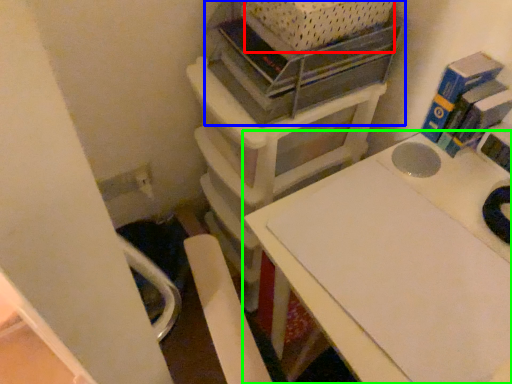
Question: Estimate the real-world distances between objects in this image. Which object is farther from crate (highlighted by a red box), shelf (highlighted by a blue box) or table (highlighted by a green box)?

Choices:
 (A) shelf
 (B) table

Answer: (B)